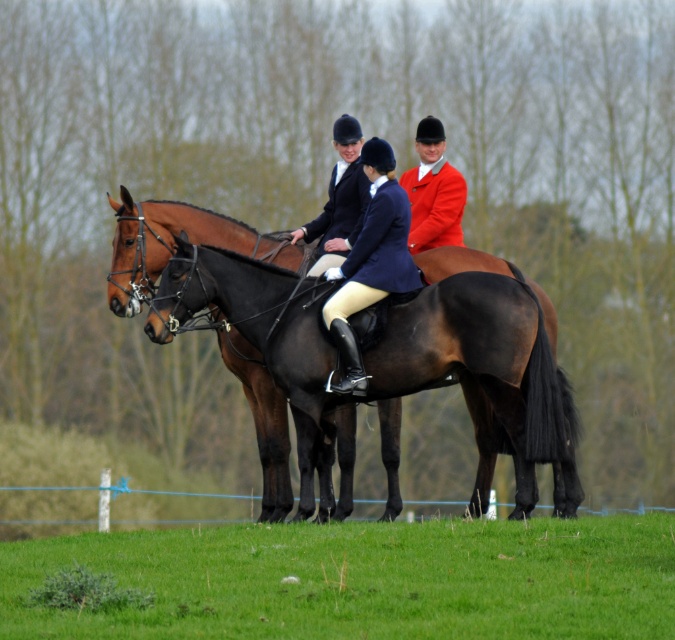
Question: Which point is closer to the camera taking this photo?

Choices:
 (A) (423, 202)
 (B) (49, 554)

Answer: (B)

Question: Does brown glossy horse at center appear under matte red coat at center?

Choices:
 (A) no
 (B) yes

Answer: (B)

Question: Which of the following is the closest to the observer?

Choices:
 (A) (435, 234)
 (B) (418, 227)
 (C) (506, 627)
 (D) (342, 179)

Answer: (C)

Question: Does green grass at lower center come behind matte red coat at center?

Choices:
 (A) yes
 (B) no

Answer: (B)

Question: Does brown glossy horse at center appear on the left side of matte black riding jacket at center?

Choices:
 (A) yes
 (B) no

Answer: (A)

Question: Which object is closer to the camera taking this photo?

Choices:
 (A) matte black riding jacket at center
 (B) matte red coat at center
 (C) brown glossy horse at center

Answer: (A)